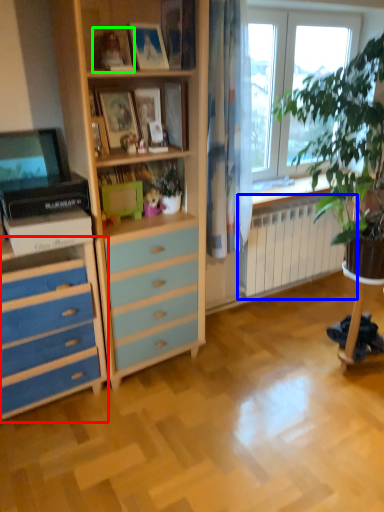
Question: Based on their relative distances, which object is farther from chest of drawers (highlighted by a red box)? Choose from radiator (highlighted by a blue box) and picture frame (highlighted by a green box).

Choices:
 (A) radiator
 (B) picture frame

Answer: (A)